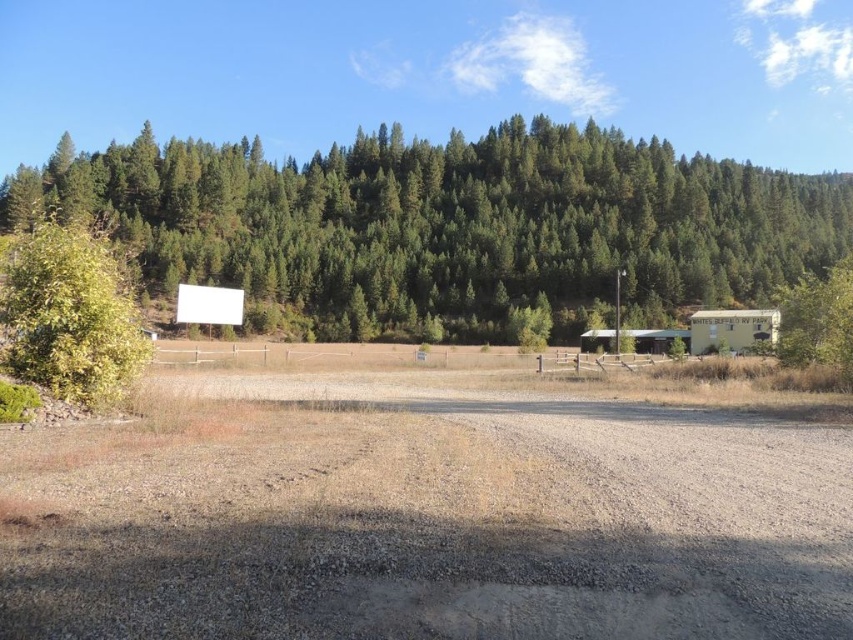
Does brown gravelly dirt field at center come in front of green textured pine trees at upper center?

Yes, it is in front of green textured pine trees at upper center.

Which is in front, point (798, 492) or point (576, 196)?

Positioned in front is point (798, 492).

Does point (326, 451) lie in front of point (511, 152)?

Yes, point (326, 451) is closer to viewer.

You are a GUI agent. You are given a task and a screenshot of the screen. Output one action in this format:
    pyautogui.click(x=<x>, y=<y>)
    Task: Click on the brown gravelly dirt field at center
    This screenshot has height=640, width=853.
    Given the screenshot: What is the action you would take?
    pyautogui.click(x=422, y=516)

Can you confirm if brown gravelly dirt field at center is bigger than green leafy bush at left?

Yes, brown gravelly dirt field at center is bigger than green leafy bush at left.

Does brown gravelly dirt field at center come behind green leafy bush at left?

No, brown gravelly dirt field at center is in front of green leafy bush at left.

Who is more forward, [13,528] or [15,280]?

Point [13,528]

This screenshot has width=853, height=640. Find the location of `brown gravelly dirt field at center`. brown gravelly dirt field at center is located at coordinates (422, 516).

Who is positioned more to the left, green textured pine trees at upper center or green leafy bush at left?

green leafy bush at left is more to the left.

Identify the location of green textured pine trees at upper center. This screenshot has height=640, width=853. (450, 224).